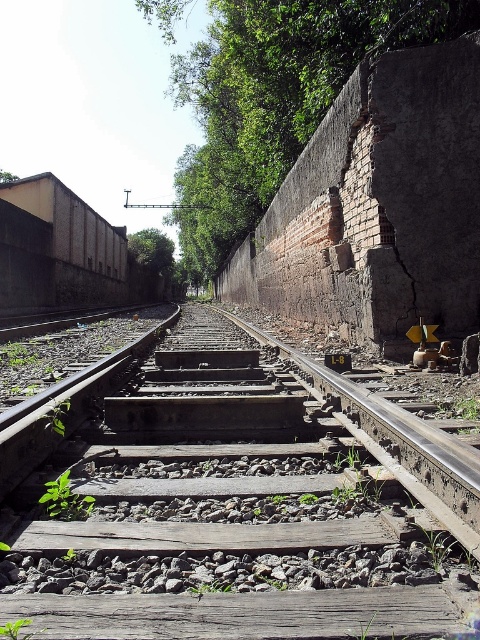
You are a maintenance worker needing to check both the brown wooden train track at center and the green leafy tree at upper center. Given that your equipment can only reach up to 30 meters, can you inspect both locations without moving your equipment?

The brown wooden train track at center and the green leafy tree at upper center are 29.96 meters apart. Since your equipment can reach up to 30 meters, you can inspect both locations without moving your equipment.

You are standing at the camera position and want to place a 2.0 meter long wooden bench between yourself and the brown wooden train track at center. Will the bench fit without overlapping the track?

The distance between the camera and the brown wooden train track at center is 2.18 meters. Since the bench is 2.0 meters long, it will fit with 0.18 meters of space remaining between the bench and the track.

You are a train engineer planning to navigate a narrow section of the railway. You observe the brown wooden train track at center and the green leafy tree at upper center. Which object has a smaller width, and does this affect your ability to pass through?

The brown wooden train track at center has a lesser width compared to the green leafy tree at upper center. Since the track itself is narrower, this may affect the train engineer as narrower tracks could pose challenges for safe passage, depending on the train size and track specifications.